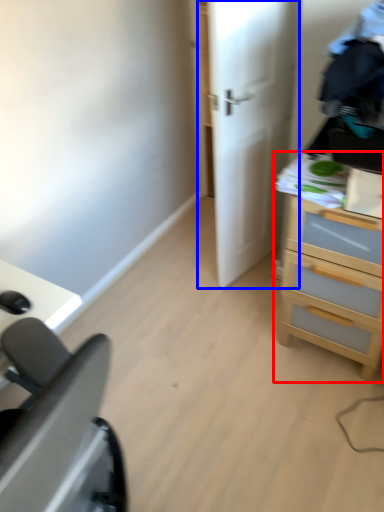
Question: Among these objects, which one is farthest to the camera, chest of drawers (highlighted by a red box) or door (highlighted by a blue box)?

Choices:
 (A) chest of drawers
 (B) door

Answer: (B)